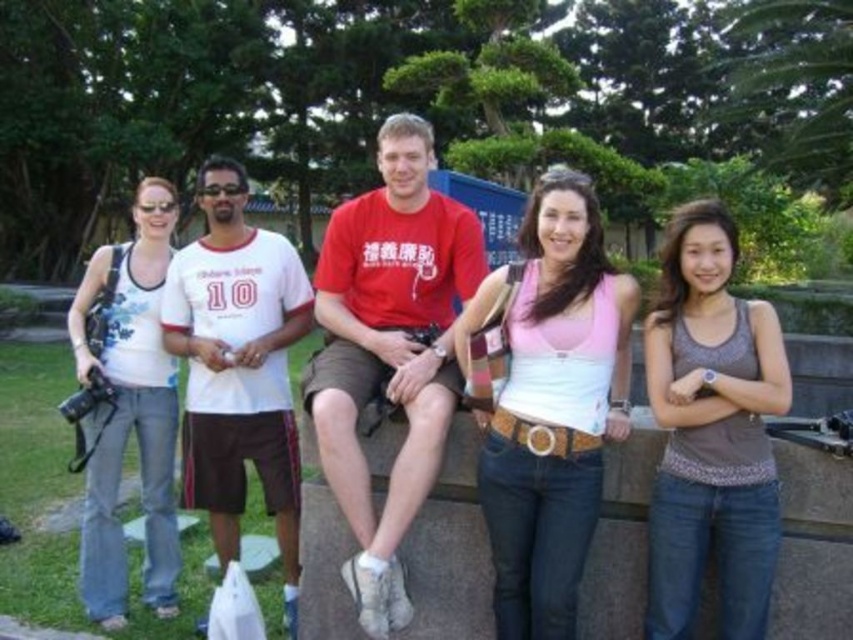
Question: Which object appears closest to the camera in this image?

Choices:
 (A) white cotton t-shirt at left
 (B) pink fabric tank top at center
 (C) gold textured belt at center

Answer: (B)

Question: Can you confirm if pink fabric tank top at center is bigger than red cotton t-shirt at center?

Choices:
 (A) no
 (B) yes

Answer: (A)

Question: Which point is closer to the camera?

Choices:
 (A) red cotton t-shirt at center
 (B) gray textured tank top at center
 (C) pink fabric tank top at center
 (D) floral printed tank top at left

Answer: (B)

Question: Where is white cotton t-shirt at left located in relation to gold textured belt at center in the image?

Choices:
 (A) right
 (B) left

Answer: (B)

Question: From the image, what is the correct spatial relationship of pink fabric tank top at center in relation to white cotton t-shirt at left?

Choices:
 (A) left
 (B) right

Answer: (B)

Question: Which of the following is the farthest from the observer?

Choices:
 (A) pink fabric tank top at center
 (B) gold textured belt at center

Answer: (B)